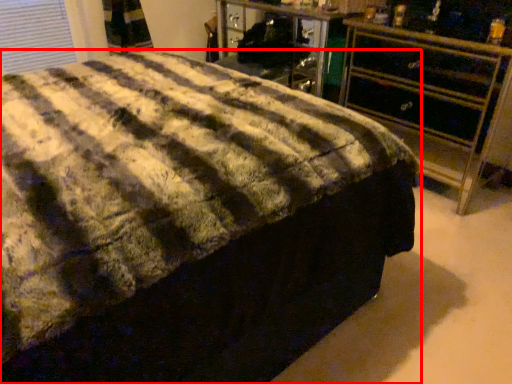
Question: From the image's perspective, what is the correct spatial positioning of bed (annotated by the red box) in reference to chest of drawers?

Choices:
 (A) above
 (B) below

Answer: (B)